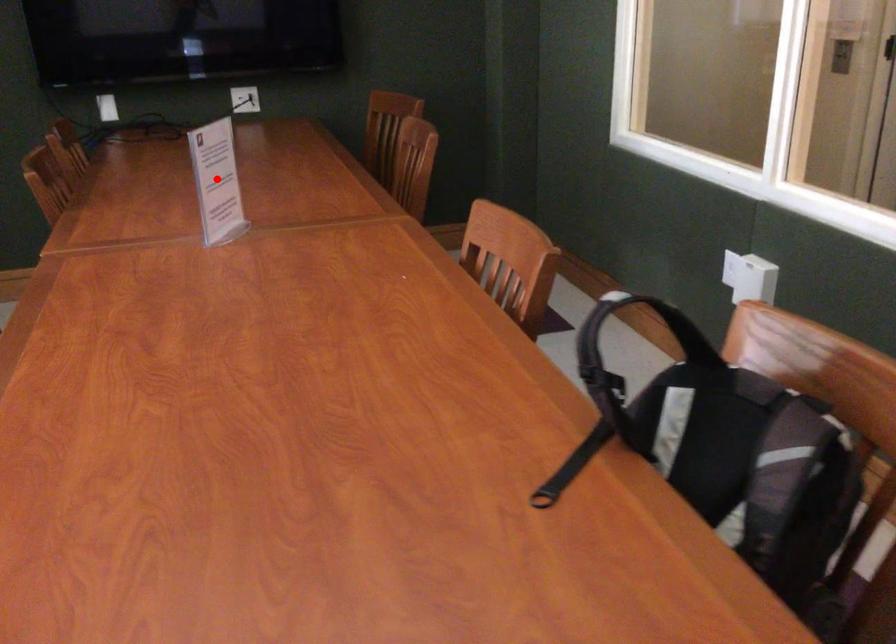
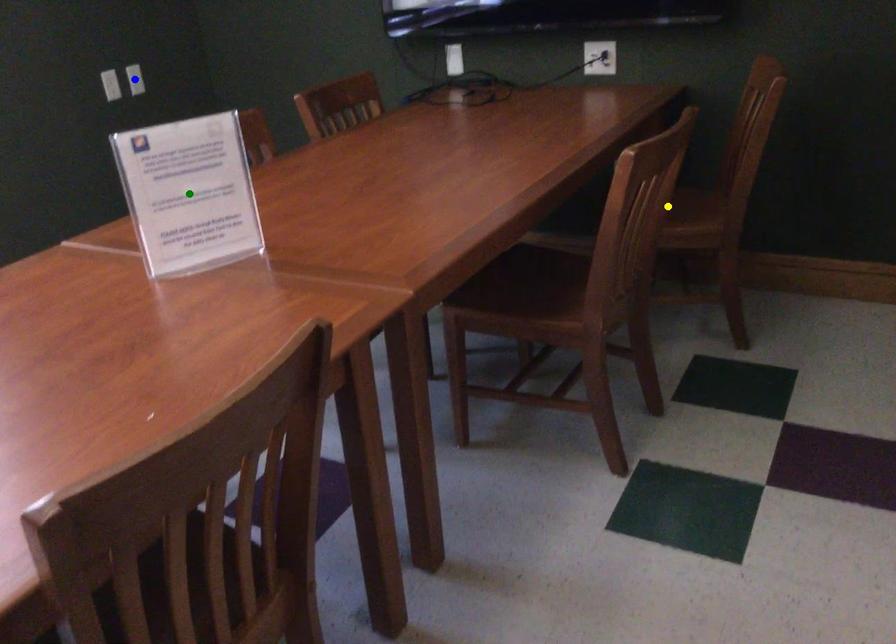
Question: I am providing you with two images of the same scene from different viewpoints. A red point is marked on the first image. You are given multiple points on the second image. Which spot in image 2 lines up with the point in image 1?

Choices:
 (A) blue point
 (B) green point
 (C) yellow point

Answer: (B)